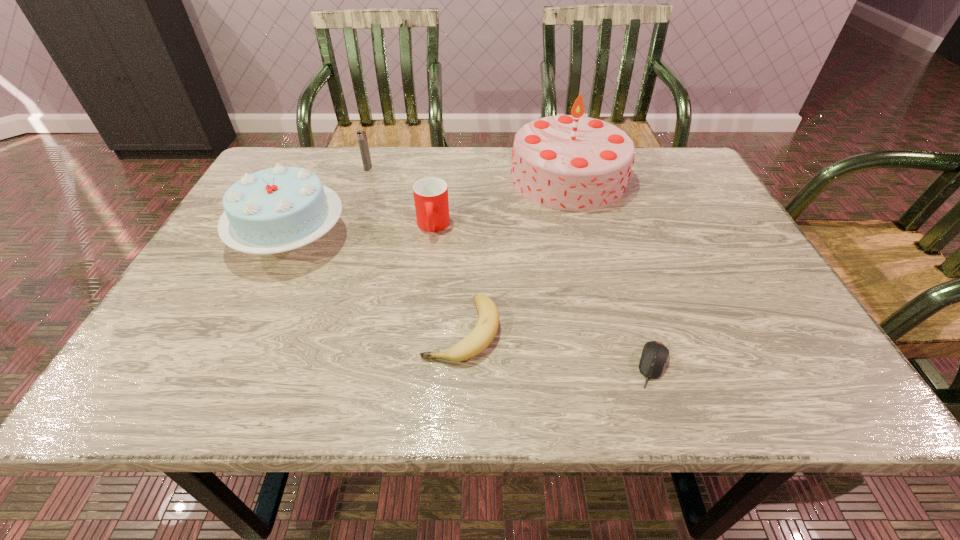
At what (x,y) coordinates should I click in order to perform the action: click on vacant point at the near edge. Please return your answer as a coordinate pair (x, y). Image resolution: width=960 pixels, height=540 pixels. Looking at the image, I should click on (375, 372).

In the image, there is a desktop. Identify the location of free space at the left edge. (172, 307).

Locate an element on the screen. vacant space at the right edge of the desktop is located at coordinates (707, 195).

Locate an element on the screen. The width and height of the screenshot is (960, 540). free space at the near left corner of the desktop is located at coordinates (188, 387).

The width and height of the screenshot is (960, 540). In the image, there is a desktop. What are the coordinates of `vacant space at the far right corner` in the screenshot? It's located at (655, 183).

Where is `vacant area between the igniter and the cup`? The image size is (960, 540). vacant area between the igniter and the cup is located at coordinates (400, 197).

Identify the location of vacant area that lies between the igniter and the cup. This screenshot has height=540, width=960. (400, 197).

This screenshot has height=540, width=960. In order to click on empty space that is in between the tallest object and the igniter in this screenshot , I will do `click(468, 173)`.

Identify the location of unoccupied area between the right birthday cake and the second shortest object. (515, 254).

Identify the location of free space between the computer mouse and the igniter. (511, 267).